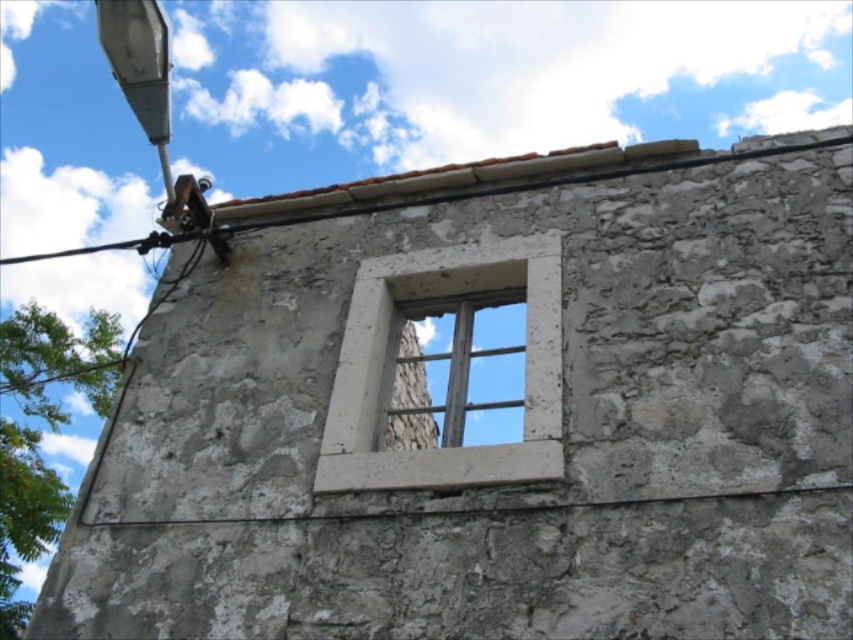
You are an architect reviewing the design of a stone building. You notice the white stone window frame at center and the wooden window at center. Which of these two elements has a narrower width according to the design specifications?

The white stone window frame at center has a lesser width compared to the wooden window at center, so the white stone window frame at center is narrower in width.

You are a painter standing 10 feet away from the white stone window frame at center and the wooden window at center. You want to paint both but can only reach up to 8 feet. Can you paint both without moving closer?

The distance between the white stone window frame at center and the wooden window at center is 4.77 feet. Since you are 10 feet away from both, your maximum reach is 8 feet, which is less than the distance to the windows. Therefore, you cannot paint either without moving closer.

You are an architect examining the stone building. You notice the wooden window at center and the white stone window frame at center. Which object is closer to you, the observer?

The white stone window frame at center is closer to you because it is in front of the wooden window at center.